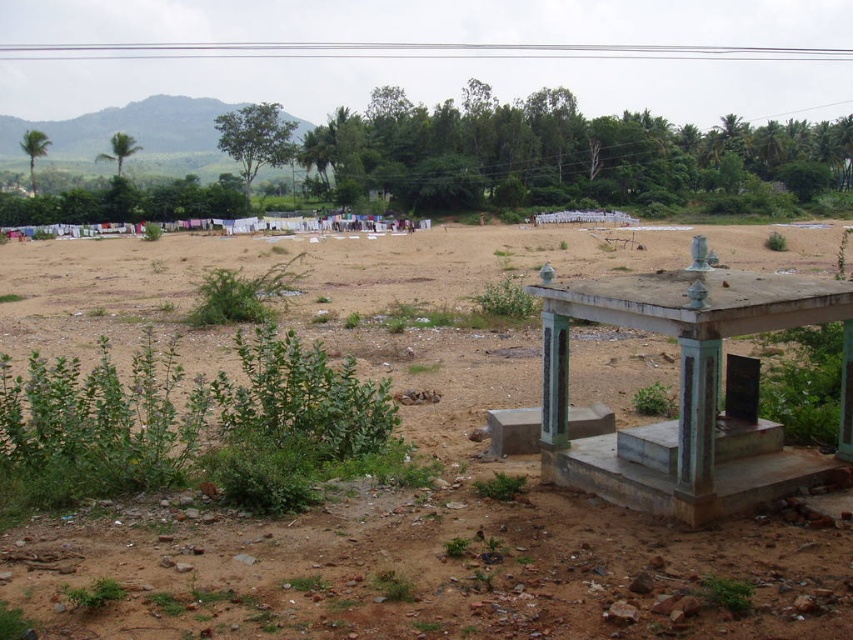
Is brown dirt field at center to the left of smooth concrete gazebo at center right from the viewer's perspective?

In fact, brown dirt field at center is to the right of smooth concrete gazebo at center right.

Can you confirm if brown dirt field at center is positioned above smooth concrete gazebo at center right?

Correct, brown dirt field at center is located above smooth concrete gazebo at center right.

Does point (184, 509) come behind point (851, 330)?

No, it is in front of (851, 330).

Find the location of `brown dirt field at center`. brown dirt field at center is located at coordinates (425, 541).